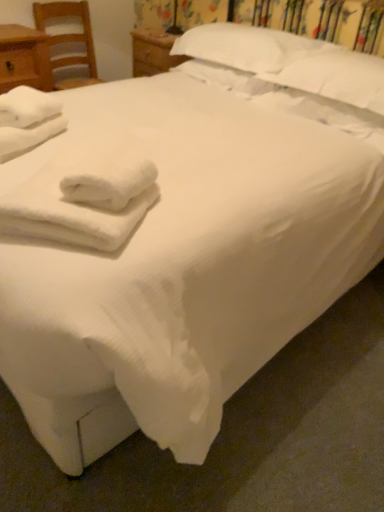
Describe the element at coordinates (247, 47) in the screenshot. The image size is (384, 512). I see `white soft pillow at upper center, the first pillow positioned from the left` at that location.

I want to click on matte wood nightstand at left, so click(x=24, y=58).

This screenshot has height=512, width=384. What are the coordinates of `white soft pillow at upper center, the first pillow positioned from the left` in the screenshot? It's located at (247, 47).

Measure the distance from white soft towel at left, which is counted as the 2th bath towel, starting from the bottom, to wooden chair at left.

white soft towel at left, which is counted as the 2th bath towel, starting from the bottom, and wooden chair at left are 5.64 feet apart.

What's the angular difference between white soft towel at left, the second bath towel positioned from the front, and wooden chair at left's facing directions?

There is a 62.5-degree angle between the facing directions of white soft towel at left, the second bath towel positioned from the front, and wooden chair at left.

Between white soft towel at left, which is counted as the 2th bath towel, starting from the bottom, and wooden chair at left, which one has more height?

With more height is wooden chair at left.

Is white soft towel at left, which ranks as the first bath towel in left-to-right order, to the left or to the right of wooden chair at left in the image?

Based on their positions, white soft towel at left, which ranks as the first bath towel in left-to-right order, is located to the right of wooden chair at left.

Is white soft pillow at upper center, the first pillow positioned from the left, far away from matte wood nightstand at left?

No, there isn't a large distance between white soft pillow at upper center, the first pillow positioned from the left, and matte wood nightstand at left.

From the image's perspective, does white soft pillow at upper center, the 2th pillow positioned from the right, appear higher than matte wood nightstand at left?

Actually, white soft pillow at upper center, the 2th pillow positioned from the right, appears below matte wood nightstand at left in the image.

Can you tell me how much white soft pillow at upper center, the first pillow positioned from the left, and matte wood nightstand at left differ in facing direction?

white soft pillow at upper center, the first pillow positioned from the left, and matte wood nightstand at left are facing 89.6 degrees away from each other.

Is matte wood nightstand at left at the back of white soft pillow at upper center, the first pillow positioned from the left?

white soft pillow at upper center, the first pillow positioned from the left, does not have its back to matte wood nightstand at left.

Can you confirm if wooden chair at left is wider than white fluffy towels at lower left, placed as the second bath towel when sorted from top to bottom?

Yes.

Which is more distant, (62, 85) or (17, 208)?

The point (62, 85) is farther.

Find the location of a particular element. This screenshot has width=384, height=512. chair behind the white fluffy towels at lower left, which is the second bath towel in left-to-right order is located at coordinates (69, 39).

Which object is further away from the camera taking this photo, wooden chair at left or white fluffy towels at lower left, which is the 1th bath towel from right to left?

wooden chair at left is more distant.

In the scene shown: Is white soft pillow at upper center, marked as the first pillow in a right-to-left arrangement, smaller than wooden chair at left?

Yes, white soft pillow at upper center, marked as the first pillow in a right-to-left arrangement, is smaller than wooden chair at left.

Looking at this image, would you say white soft pillow at upper center, marked as the first pillow in a right-to-left arrangement, contains wooden chair at left?

No, white soft pillow at upper center, marked as the first pillow in a right-to-left arrangement, does not contain wooden chair at left.

Is white soft pillow at upper center, marked as the first pillow in a right-to-left arrangement, not near wooden chair at left?

white soft pillow at upper center, marked as the first pillow in a right-to-left arrangement, is positioned a significant distance from wooden chair at left.

Based on their positions, is white soft pillow at upper center, marked as the first pillow in a right-to-left arrangement, located to the left or right of white soft towel at left, the second bath towel positioned from the front?

Clearly, white soft pillow at upper center, marked as the first pillow in a right-to-left arrangement, is on the right of white soft towel at left, the second bath towel positioned from the front, in the image.

Could white soft towel at left, the 1th bath towel when ordered from top to bottom, be considered to be inside white soft pillow at upper center, marked as the first pillow in a right-to-left arrangement?

No, white soft towel at left, the 1th bath towel when ordered from top to bottom, is not a part of white soft pillow at upper center, marked as the first pillow in a right-to-left arrangement.

From the image's perspective, which one is positioned lower, white soft pillow at upper center, marked as the first pillow in a right-to-left arrangement, or white soft towel at left, which appears as the second bath towel when viewed from the right?

white soft towel at left, which appears as the second bath towel when viewed from the right, from the image's perspective.

Locate an element on the screen. The width and height of the screenshot is (384, 512). pillow that is the 1st object located above the white soft towel at left, the 1th bath towel when ordered from top to bottom (from the image's perspective) is located at coordinates (336, 77).

From a real-world perspective, is wooden chair at left on white soft towel at left, which is counted as the 2th bath towel, starting from the bottom?

No, from a real-world perspective, wooden chair at left is not over white soft towel at left, which is counted as the 2th bath towel, starting from the bottom

In terms of size, does wooden chair at left appear bigger or smaller than white soft towel at left, which appears as the second bath towel when viewed from the right?

Clearly, wooden chair at left is larger in size than white soft towel at left, which appears as the second bath towel when viewed from the right.

Is wooden chair at left oriented away from white soft towel at left, which ranks as the first bath towel in left-to-right order?

No.

Does point (66, 9) come farther from viewer compared to point (48, 128)?

That is True.

Does matte wood nightstand at left have a lesser height compared to white soft pillow at upper center, marked as the first pillow in a right-to-left arrangement?

In fact, matte wood nightstand at left may be taller than white soft pillow at upper center, marked as the first pillow in a right-to-left arrangement.

Is the position of matte wood nightstand at left less distant than that of white soft pillow at upper center, marked as the first pillow in a right-to-left arrangement?

No, matte wood nightstand at left is further to the viewer.

Locate an element on the screen. Image resolution: width=384 pixels, height=512 pixels. chair behind the white soft towel at left, the 1th bath towel when ordered from top to bottom is located at coordinates (69, 39).

At what (x,y) coordinates should I click in order to perform the action: click on nightstand that appears above the white soft pillow at upper center, the 2th pillow positioned from the right (from the image's perspective). Please return your answer as a coordinate pair (x, y). The image size is (384, 512). Looking at the image, I should click on (24, 58).

Estimate the real-world distances between objects in this image. Which object is further from white soft pillow at upper center, the first pillow positioned from the left, white soft towel at left, the 1th bath towel when ordered from top to bottom, or wooden chair at left?

Based on the image, wooden chair at left appears to be further to white soft pillow at upper center, the first pillow positioned from the left.

Looking at the image, which one is located further to wooden chair at left, matte wood nightstand at left or white soft pillow at upper center, the first pillow positioned from the left?

white soft pillow at upper center, the first pillow positioned from the left, is further to wooden chair at left.

Estimate the real-world distances between objects in this image. Which object is further from matte wood nightstand at left, white fluffy towels at lower left, placed as the second bath towel when sorted from top to bottom, or white soft pillow at upper center, the 2th pillow positioned from the right?

white fluffy towels at lower left, placed as the second bath towel when sorted from top to bottom.

Considering their positions, is white fluffy towels at lower left, which is the 1th bath towel in front-to-back order, positioned closer to white soft pillow at upper center, the first pillow positioned from the left, than white soft towel at left, the 1th bath towel when ordered from top to bottom?

white soft towel at left, the 1th bath towel when ordered from top to bottom, is closer to white soft pillow at upper center, the first pillow positioned from the left.

Based on their spatial positions, is white soft towel at left, arranged as the 1th bath towel when viewed from the back, or wooden chair at left closer to white soft pillow at upper center, marked as the first pillow in a right-to-left arrangement?

The object closer to white soft pillow at upper center, marked as the first pillow in a right-to-left arrangement, is white soft towel at left, arranged as the 1th bath towel when viewed from the back.

Looking at this image, looking at the image, which one is located closer to wooden chair at left, white soft pillow at upper center, marked as the first pillow in a right-to-left arrangement, or white soft towel at left, the second bath towel positioned from the front?

Among the two, white soft towel at left, the second bath towel positioned from the front, is located nearer to wooden chair at left.

When comparing their distances from white soft pillow at upper center, the first pillow positioned from the left, does wooden chair at left or white soft towel at left, the second bath towel positioned from the front, seem further?

The object further to white soft pillow at upper center, the first pillow positioned from the left, is wooden chair at left.

Estimate the real-world distances between objects in this image. Which object is further from white fluffy towels at lower left, which is the second bath towel in left-to-right order, white soft pillow at upper center, the 2th pillow positioned from the right, or white soft pillow at upper center, marked as the first pillow in a right-to-left arrangement?

Based on the image, white soft pillow at upper center, the 2th pillow positioned from the right, appears to be further to white fluffy towels at lower left, which is the second bath towel in left-to-right order.

Identify the location of pillow located between wooden chair at left and white soft pillow at upper center, placed as the 2th pillow when sorted from left to right, in the left-right direction. 247,47.

I want to click on bath towel between white soft towel at left, arranged as the 1th bath towel when viewed from the back, and white soft pillow at upper center, the 2th pillow positioned from the right, so click(x=68, y=214).

Where is `nightstand located between white soft towel at left, which is counted as the 2th bath towel, starting from the bottom, and wooden chair at left in the depth direction`? The height and width of the screenshot is (512, 384). nightstand located between white soft towel at left, which is counted as the 2th bath towel, starting from the bottom, and wooden chair at left in the depth direction is located at coordinates (24, 58).

The width and height of the screenshot is (384, 512). I want to click on pillow situated between white fluffy towels at lower left, placed as the second bath towel when sorted from top to bottom, and white soft pillow at upper center, placed as the 2th pillow when sorted from left to right, from left to right, so click(x=247, y=47).